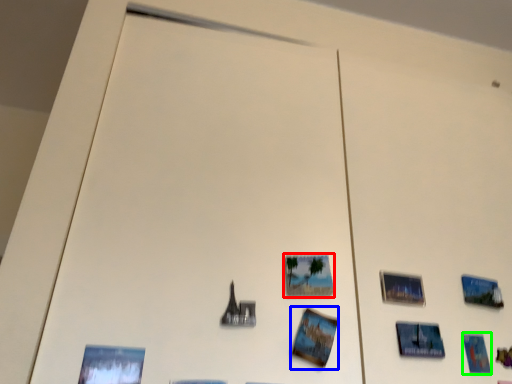
Question: Estimate the real-world distances between objects in this image. Which object is farther from picture frame (highlighted by a red box), postcard (highlighted by a blue box) or postcard (highlighted by a green box)?

Choices:
 (A) postcard
 (B) postcard

Answer: (B)